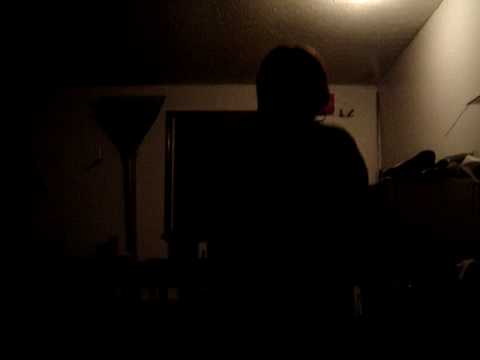
Where is `doorway`? The width and height of the screenshot is (480, 360). doorway is located at coordinates (195, 143).